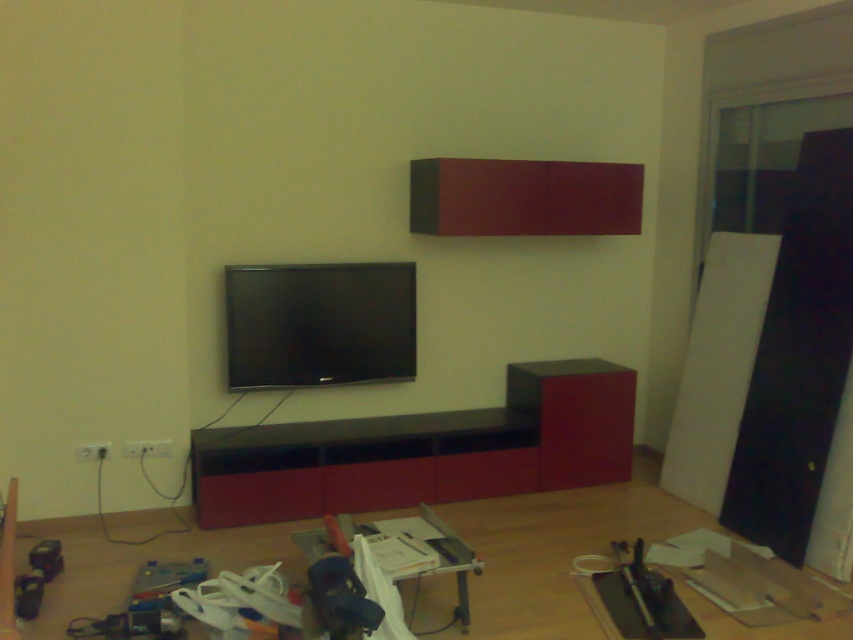
You are a delivery person standing at the entrance of the room. You need to place a large box that is 3 meters in length in the space between the entrance and the matte black entertainment center at center. Is there enough space for the box?

The distance between the matte black entertainment center at center and the viewer is 3.60 meters. Since the box is 3 meters long, there is sufficient space to place it between the entrance and the matte black entertainment center at center.

You are standing in the room and want to locate the matte black entertainment center at center. According to the coordinates provided, in which direction should you look relative to your current position?

The matte black entertainment center at center is located at point coordinates (422, 451). Since coordinates are typically represented as x,y with (0, 0) being the bottom left corner, this would place it towards the upper right of the image. Therefore, you should look towards the upper right direction to locate it.

You are a delivery person who just arrived with a new gaming console. You need to place it on the closest object to you between the matte black entertainment center at center and the black glossy flat screen tv at center. Which object should you choose?

The matte black entertainment center at center is closer to the viewer than the black glossy flat screen tv at center, so you should place the gaming console on the matte black entertainment center at center.